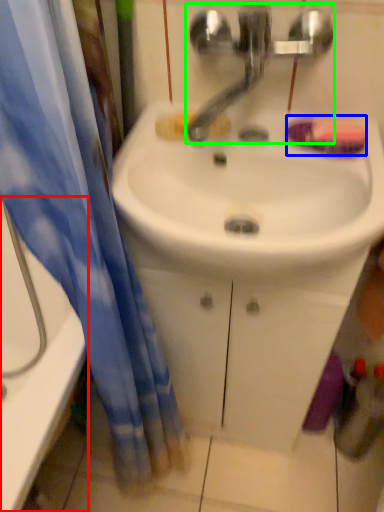
Question: Which object is positioned closest to bathtub (highlighted by a red box)? Select from soap (highlighted by a blue box) and tap (highlighted by a green box).

Choices:
 (A) soap
 (B) tap

Answer: (B)